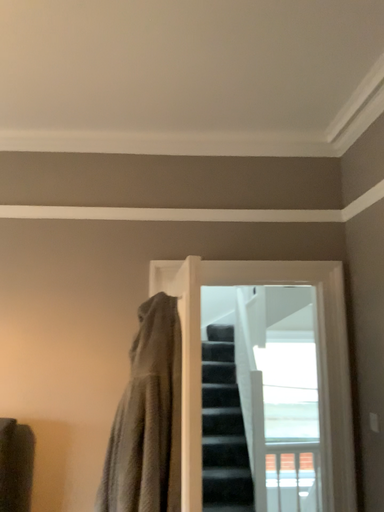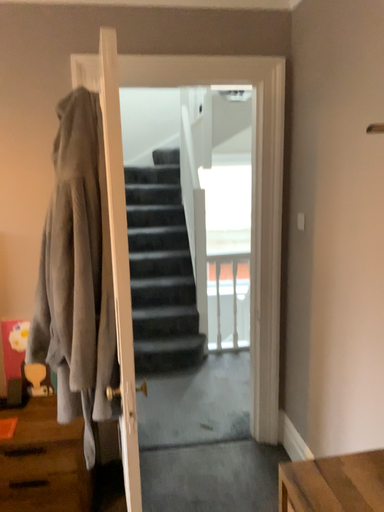
Question: How did the camera likely rotate when shooting the video?

Choices:
 (A) rotated upward
 (B) rotated downward

Answer: (B)